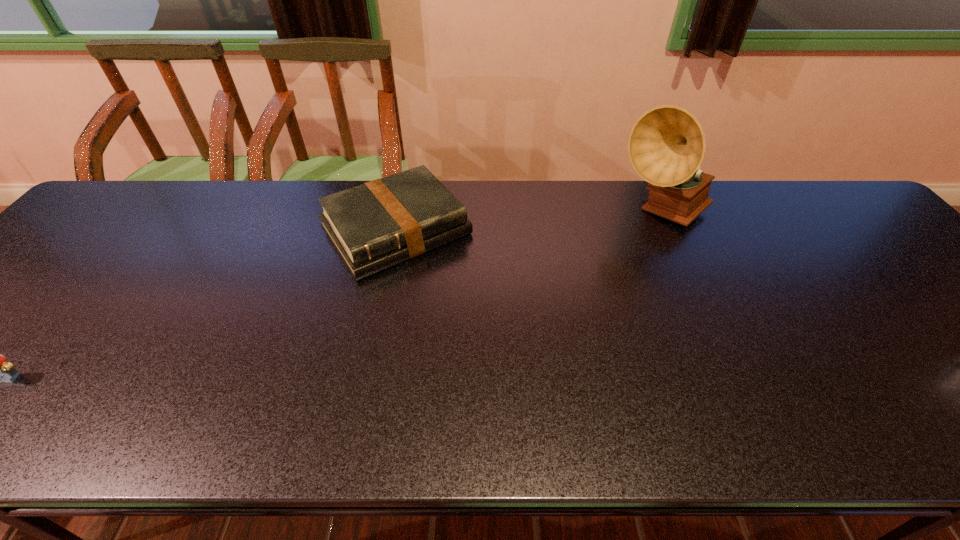
The image size is (960, 540). What are the coordinates of `hardback book present at the far edge` in the screenshot? It's located at (381, 223).

Locate an element on the screen. phonograph record that is at the far edge is located at coordinates (666, 146).

The image size is (960, 540). I want to click on vacant position at the far edge of the desktop, so click(x=534, y=218).

The width and height of the screenshot is (960, 540). In the image, there is a desktop. What are the coordinates of `vacant space at the near edge` in the screenshot? It's located at (673, 366).

In the image, there is a desktop. At what (x,y) coordinates should I click in order to perform the action: click on free space at the left edge. Please return your answer as a coordinate pair (x, y). Looking at the image, I should click on (94, 277).

The height and width of the screenshot is (540, 960). In the image, there is a desktop. Find the location of `vacant space at the far left corner`. vacant space at the far left corner is located at coordinates (132, 197).

I want to click on free space between the hardback book and the rightmost object, so click(529, 222).

Find the location of a particular element. free space between the hardback book and the phonograph record is located at coordinates (529, 222).

Identify which object is the nearest to the hardback book. Please provide its 2D coordinates. Your answer should be formatted as a tuple, i.e. [(x, y)], where the tuple contains the x and y coordinates of a point satisfying the conditions above.

[(666, 146)]

Point out which object is positioned as the nearest to the rightmost object. Please provide its 2D coordinates. Your answer should be formatted as a tuple, i.e. [(x, y)], where the tuple contains the x and y coordinates of a point satisfying the conditions above.

[(381, 223)]